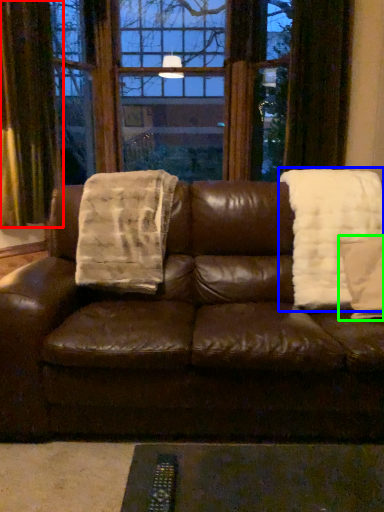
Question: Estimate the real-world distances between objects in this image. Which object is closer to curtain (highlighted by a red box), blanket (highlighted by a blue box) or throw pillow (highlighted by a green box)?

Choices:
 (A) blanket
 (B) throw pillow

Answer: (A)